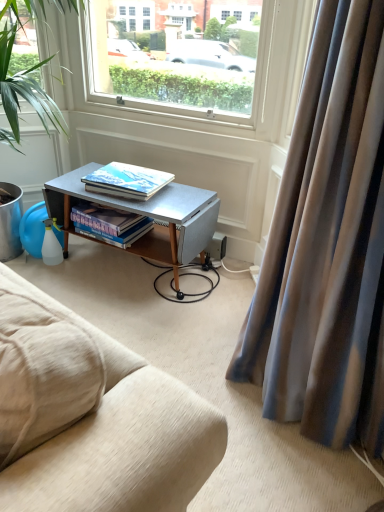
I want to click on unoccupied region to the right of matte hardcover book at center, placed as the first book when sorted from top to bottom, so click(182, 198).